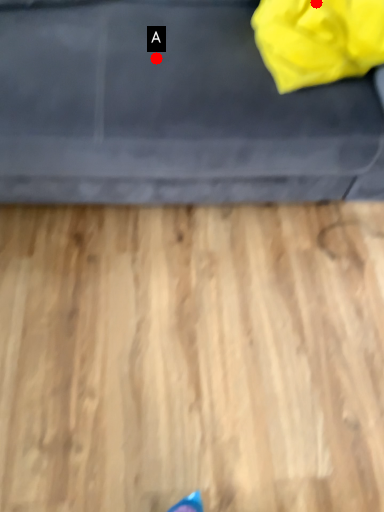
Question: Two points are circled on the image, labeled by A and B beside each circle. Among these points, which one is nearest to the camera?

Choices:
 (A) A is closer
 (B) B is closer

Answer: (B)